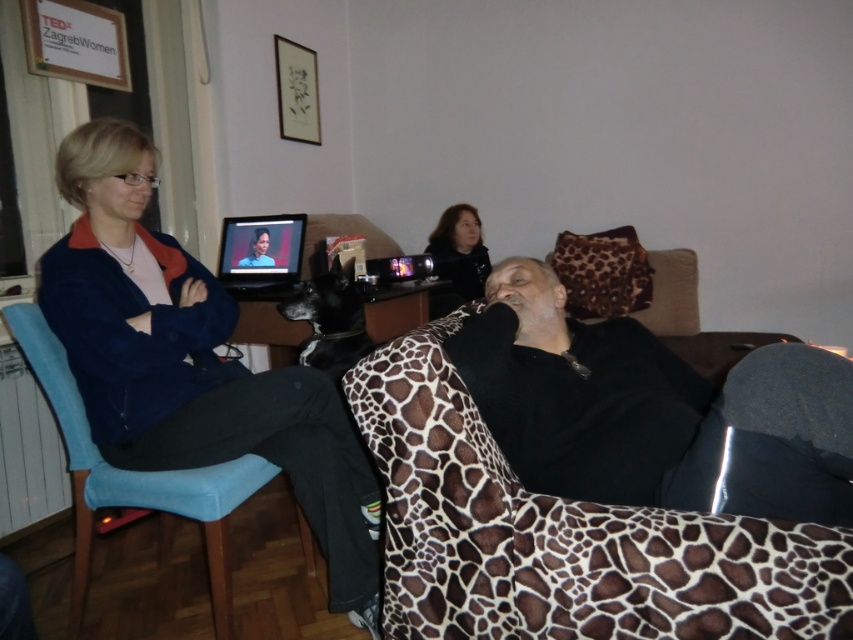
In the scene shown: Between blue fabric chair at left and smooth black hair at center, which one is positioned higher?

Positioned higher is smooth black hair at center.

Who is positioned more to the right, blue fabric chair at left or smooth black hair at center?

Positioned to the right is smooth black hair at center.

Is point (13, 320) positioned in front of point (436, 259)?

Yes.

Identify the location of blue fabric chair at left. (132, 474).

How far apart are black matte shirt at center and smooth black hair at center?

A distance of 5.81 feet exists between black matte shirt at center and smooth black hair at center.

Can you confirm if black matte shirt at center is positioned above smooth black hair at center?

No, black matte shirt at center is not above smooth black hair at center.

Locate an element on the screen. black matte shirt at center is located at coordinates (653, 410).

Which is behind, point (149, 323) or point (540, 273)?

Point (540, 273)

Is point (39, 282) closer to viewer compared to point (640, 360)?

No, it is behind (640, 360).

At what (x,y) coordinates should I click in order to perform the action: click on matte blue jacket at left. Please return your answer as a coordinate pair (x, y). The image size is (853, 640). Looking at the image, I should click on (193, 362).